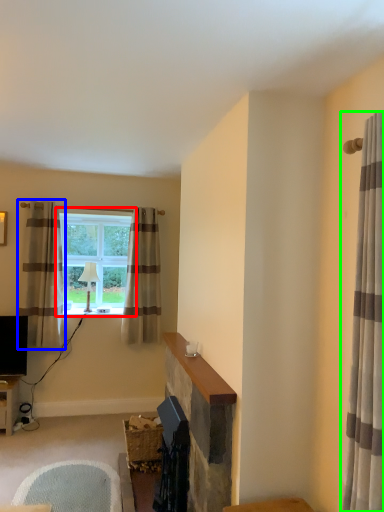
Question: Estimate the real-world distances between objects in this image. Which object is farther from window (highlighted by a red box), curtain (highlighted by a blue box) or curtain (highlighted by a green box)?

Choices:
 (A) curtain
 (B) curtain

Answer: (B)